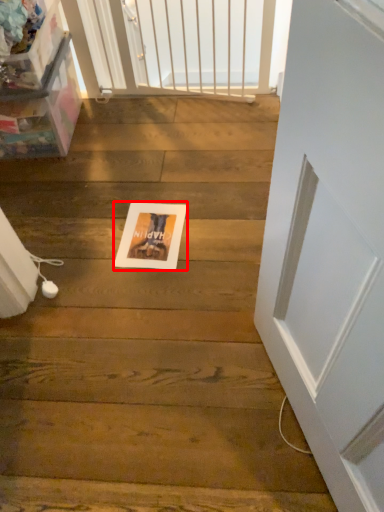
Question: From the image's perspective, what is the correct spatial positioning of postcard (annotated by the red box) in reference to screen door?

Choices:
 (A) above
 (B) below

Answer: (B)